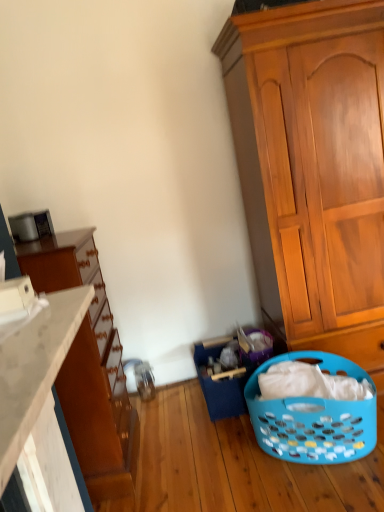
Question: Is wooden cabinet at right closer to camera compared to white matte countertop at lower left?

Choices:
 (A) yes
 (B) no

Answer: (B)

Question: From a real-world perspective, is wooden cabinet at right positioned over white matte countertop at lower left based on gravity?

Choices:
 (A) no
 (B) yes

Answer: (A)

Question: Does wooden cabinet at right have a larger size compared to white matte countertop at lower left?

Choices:
 (A) yes
 (B) no

Answer: (A)

Question: Is wooden cabinet at right completely or partially outside of white matte countertop at lower left?

Choices:
 (A) yes
 (B) no

Answer: (A)

Question: Is wooden cabinet at right turned away from white matte countertop at lower left?

Choices:
 (A) no
 (B) yes

Answer: (A)

Question: Is point (44, 335) closer or farther from the camera than point (205, 355)?

Choices:
 (A) farther
 (B) closer

Answer: (B)

Question: Is white matte countertop at lower left taller or shorter than blue plastic laundry basket at lower center?

Choices:
 (A) tall
 (B) short

Answer: (B)

Question: From a real-world perspective, is white matte countertop at lower left above or below blue plastic laundry basket at lower center?

Choices:
 (A) below
 (B) above

Answer: (B)

Question: Is white matte countertop at lower left inside or outside of blue plastic laundry basket at lower center?

Choices:
 (A) inside
 (B) outside

Answer: (B)

Question: From the image's perspective, is blue plastic laundry basket at lower right above or below blue plastic laundry basket at lower center?

Choices:
 (A) below
 (B) above

Answer: (A)

Question: Would you say blue plastic laundry basket at lower right is inside or outside blue plastic laundry basket at lower center?

Choices:
 (A) outside
 (B) inside

Answer: (A)

Question: Looking at the image, does blue plastic laundry basket at lower right seem bigger or smaller compared to blue plastic laundry basket at lower center?

Choices:
 (A) big
 (B) small

Answer: (A)

Question: Would you say blue plastic laundry basket at lower right is to the left or to the right of blue plastic laundry basket at lower center in the picture?

Choices:
 (A) left
 (B) right

Answer: (B)

Question: Is white matte countertop at lower left spatially inside matte brown dresser at left, or outside of it?

Choices:
 (A) inside
 (B) outside

Answer: (B)

Question: Is white matte countertop at lower left in front of or behind matte brown dresser at left in the image?

Choices:
 (A) front
 (B) behind

Answer: (A)